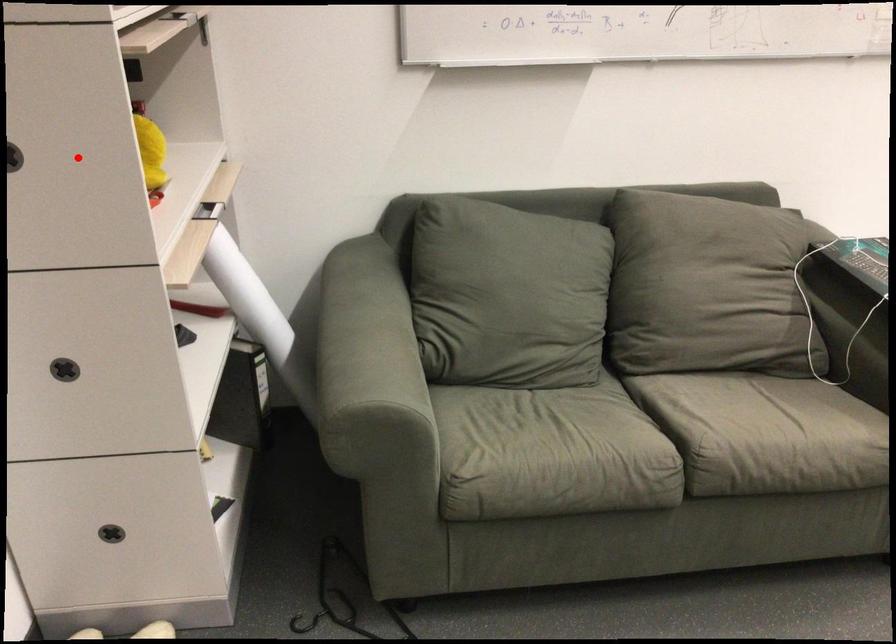
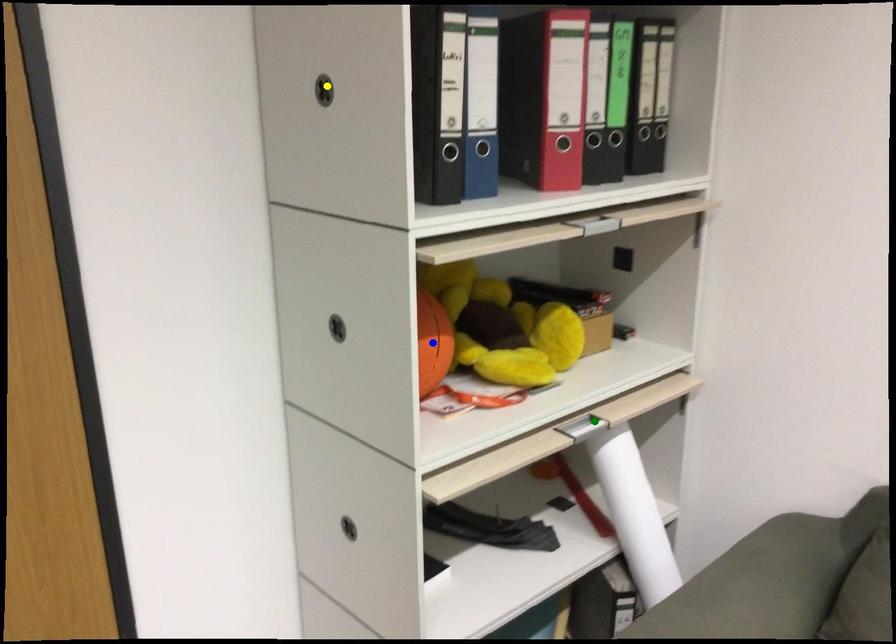
Question: I am providing you with two images of the same scene from different viewpoints. A red point is marked on the first image. You are given multiple points on the second image. Which point in image 2 is actually the same real-world point as the red point in image 1?

Choices:
 (A) blue point
 (B) green point
 (C) yellow point

Answer: (A)